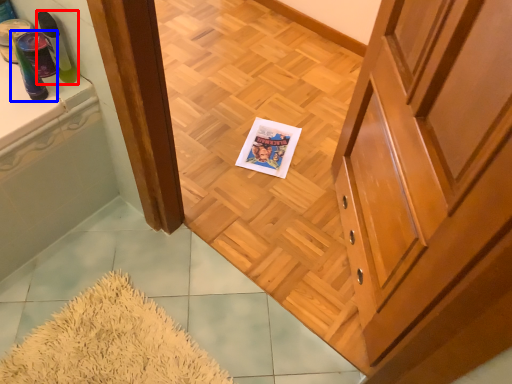
Question: Which object is closer to the camera taking this photo, toiletry (highlighted by a red box) or toiletry (highlighted by a blue box)?

Choices:
 (A) toiletry
 (B) toiletry

Answer: (B)